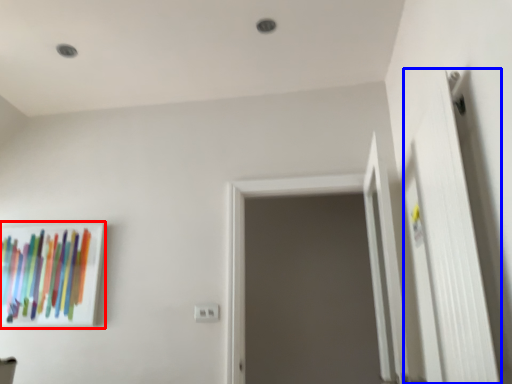
Question: Which object is closer to the camera taking this photo, picture frame (highlighted by a red box) or door (highlighted by a blue box)?

Choices:
 (A) picture frame
 (B) door

Answer: (B)